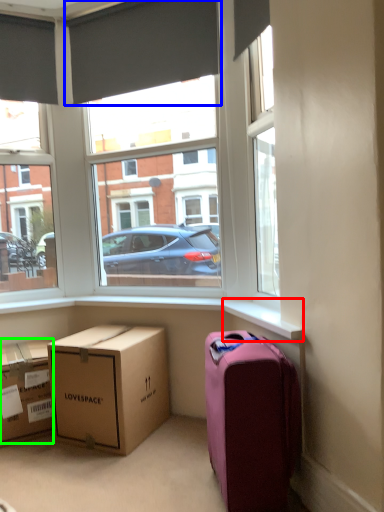
Question: Which is farther away from window sill (highlighted by a red box)? curtain (highlighted by a blue box) or box (highlighted by a green box)?

Choices:
 (A) curtain
 (B) box

Answer: (A)